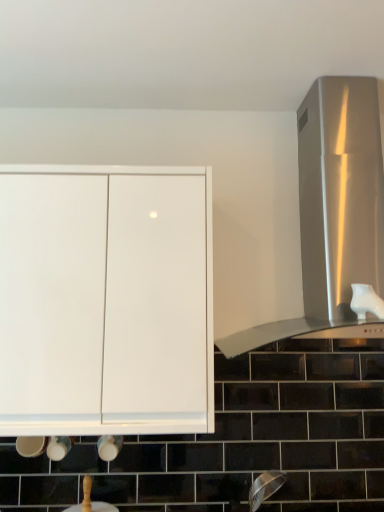
Question: From a real-world perspective, is white glossy sink at lower center above or below stainless steel vent at right?

Choices:
 (A) above
 (B) below

Answer: (B)

Question: Relative to stainless steel vent at right, is white glossy sink at lower center in front or behind?

Choices:
 (A) behind
 (B) front

Answer: (A)

Question: Based on their relative distances, which object is farther from the stainless steel vent at right?

Choices:
 (A) white glossy cabinet at upper left
 (B) white glossy sink at lower center

Answer: (B)

Question: Which is farther from the white glossy cabinet at upper left?

Choices:
 (A) white glossy sink at lower center
 (B) stainless steel vent at right

Answer: (A)